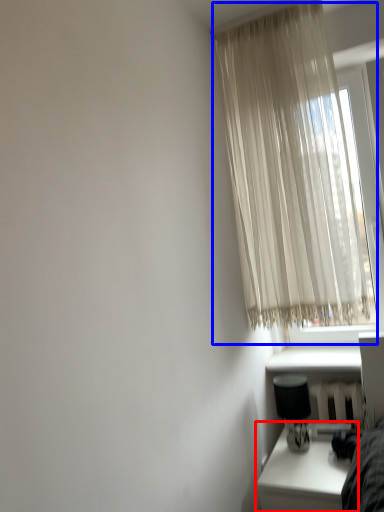
Question: Which object appears farthest to the camera in this image, table (highlighted by a red box) or curtain (highlighted by a blue box)?

Choices:
 (A) table
 (B) curtain

Answer: (B)